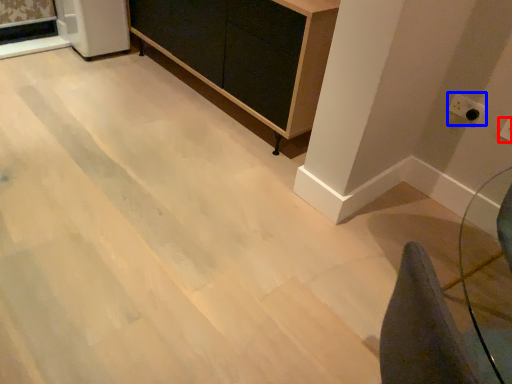
Question: Which point is closer to the camera, electric outlet (highlighted by a red box) or electric outlet (highlighted by a blue box)?

Choices:
 (A) electric outlet
 (B) electric outlet

Answer: (A)